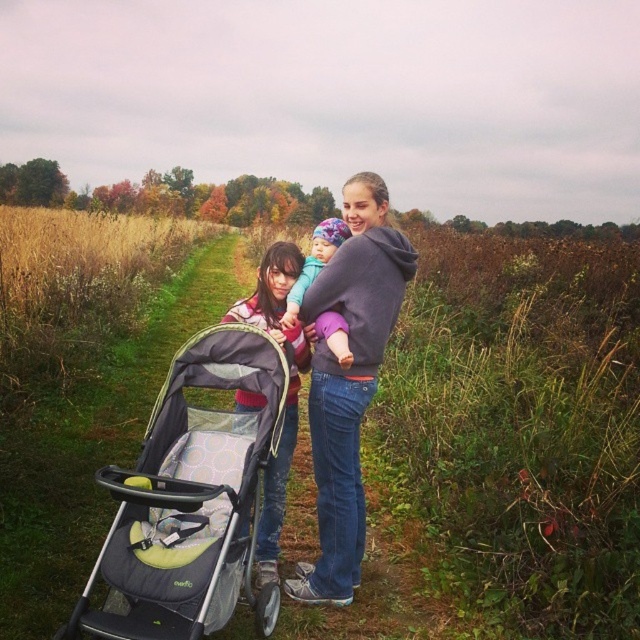
Question: Which point is closer to the camera?

Choices:
 (A) (208, 577)
 (B) (339, 320)
 (C) (269, 324)

Answer: (A)

Question: Can you confirm if matte pink sweater at center is wider than purple fleece jacket at center?

Choices:
 (A) yes
 (B) no

Answer: (A)

Question: Can you confirm if black fabric stroller at center is positioned below matte pink sweater at center?

Choices:
 (A) no
 (B) yes

Answer: (B)

Question: Estimate the real-world distances between objects in this image. Which object is farther from the matte pink sweater at center?

Choices:
 (A) black fabric stroller at center
 (B) purple fleece jacket at center

Answer: (B)

Question: Does black fabric stroller at center have a smaller size compared to purple fleece jacket at center?

Choices:
 (A) yes
 (B) no

Answer: (B)

Question: Which point is closer to the camera?

Choices:
 (A) black fabric stroller at center
 (B) purple fleece jacket at center
 (C) matte pink sweater at center

Answer: (A)